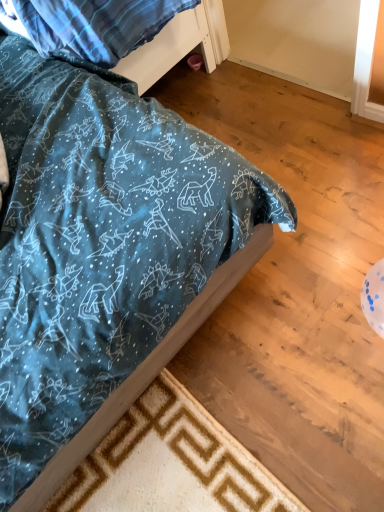
At what (x,y) coordinates should I click in order to perform the action: click on blue printed fabric at upper left. Please return your answer as a coordinate pair (x, y). The width and height of the screenshot is (384, 512). Looking at the image, I should click on (93, 25).

In order to face blue printed fabric at upper left, should I rotate leftwards or rightwards?

Rotate left and turn 13.910 degrees.

What do you see at coordinates (93, 25) in the screenshot? I see `blue printed fabric at upper left` at bounding box center [93, 25].

The image size is (384, 512). Identify the location of blue printed fabric at upper left. (93, 25).